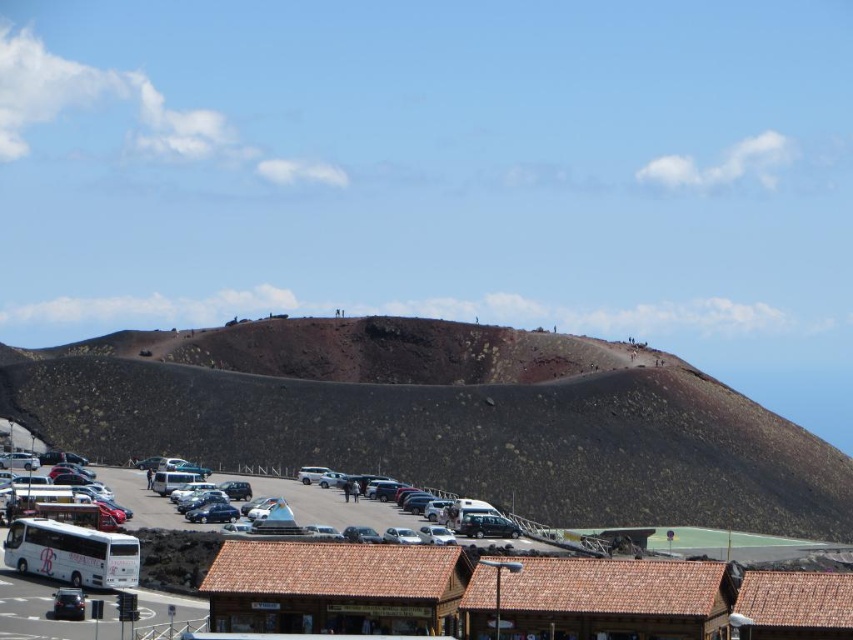
Question: Considering the real-world distances, which object is farthest from the white matte bus at lower left?

Choices:
 (A) white matte bus at center
 (B) volcanic rock mountain at upper center

Answer: (B)

Question: In this image, where is white matte bus at lower left located relative to white matte bus at center?

Choices:
 (A) right
 (B) left

Answer: (B)

Question: Which point appears closest to the camera in this image?

Choices:
 (A) (171, 484)
 (B) (26, 524)
 (C) (503, 440)

Answer: (B)

Question: Is white matte bus at lower left below white matte bus at center?

Choices:
 (A) no
 (B) yes

Answer: (B)

Question: Is volcanic rock mountain at upper center thinner than white matte bus at center?

Choices:
 (A) no
 (B) yes

Answer: (A)

Question: Which point appears farthest from the camera in this image?

Choices:
 (A) (483, 333)
 (B) (44, 564)
 (C) (186, 472)

Answer: (A)